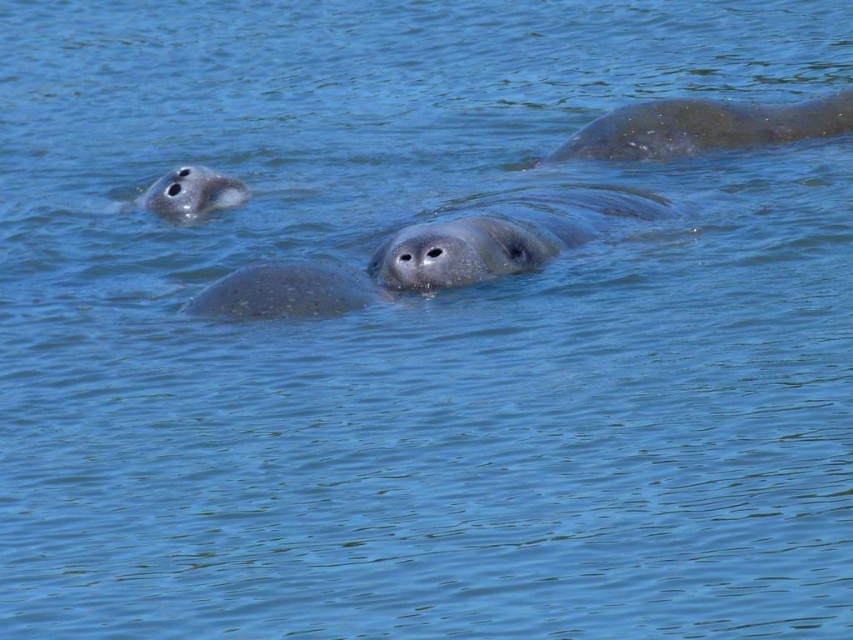
Which is in front, point (613, 131) or point (492, 221)?

Positioned in front is point (492, 221).

Measure the distance between gray matte seal at upper right and gray matte seal at center.

A distance of 1.27 meters exists between gray matte seal at upper right and gray matte seal at center.

Find the location of a particular element. The height and width of the screenshot is (640, 853). gray matte seal at upper right is located at coordinates (701, 128).

Is point (514, 269) closer to viewer compared to point (339, 266)?

No, (514, 269) is behind (339, 266).

Who is higher up, gray matte seal at center or smooth gray seal at center?

gray matte seal at center

You are a GUI agent. You are given a task and a screenshot of the screen. Output one action in this format:
    pyautogui.click(x=<x>, y=<y>)
    Task: Click on the gray matte seal at center
    The height and width of the screenshot is (640, 853).
    Given the screenshot: What is the action you would take?
    pyautogui.click(x=459, y=252)

Can you confirm if smooth gray seal at center is smaller than gray matte seal at upper left?

Incorrect, smooth gray seal at center is not smaller in size than gray matte seal at upper left.

Measure the distance between point (247, 285) and camera.

Point (247, 285) and camera are 14.52 feet apart.

The width and height of the screenshot is (853, 640). Identify the location of smooth gray seal at center. (286, 291).